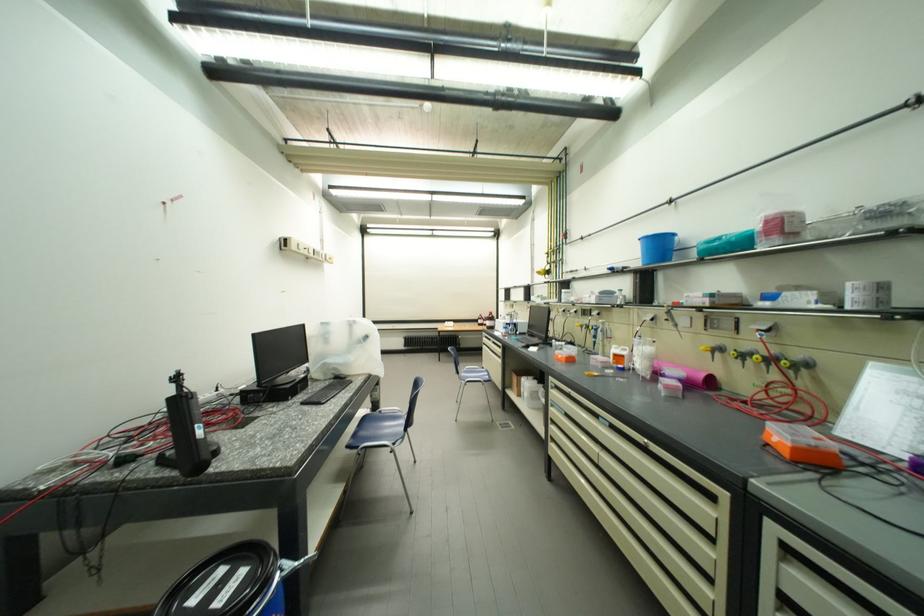
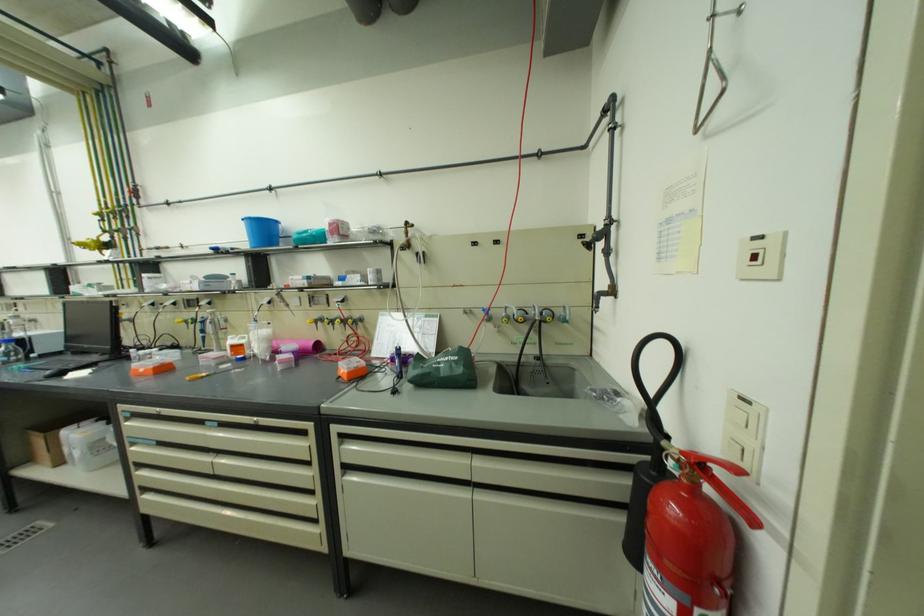
Question: The images are taken continuously from a first-person perspective. In which direction is your viewpoint rotating?

Choices:
 (A) Left
 (B) Right
 (C) Up
 (D) Down

Answer: (B)